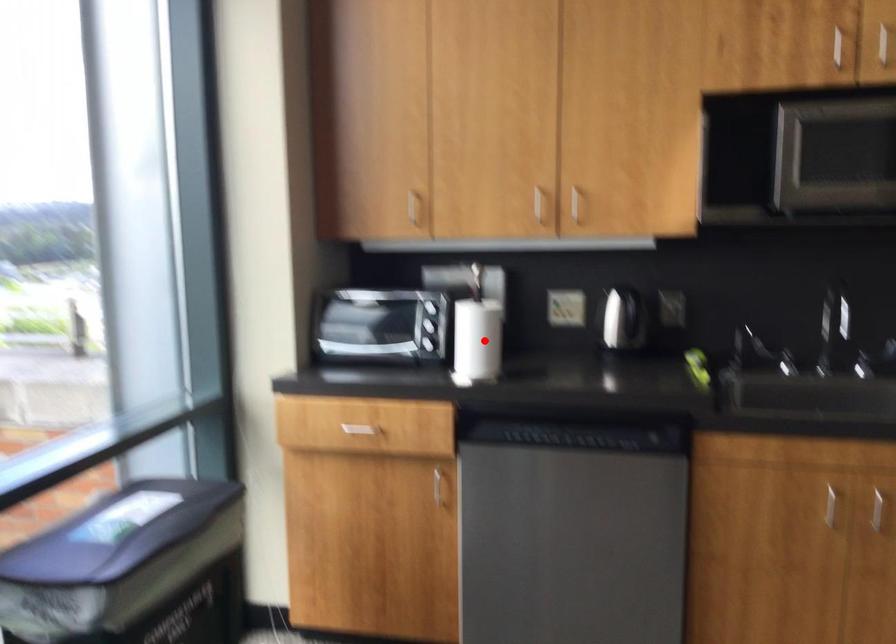
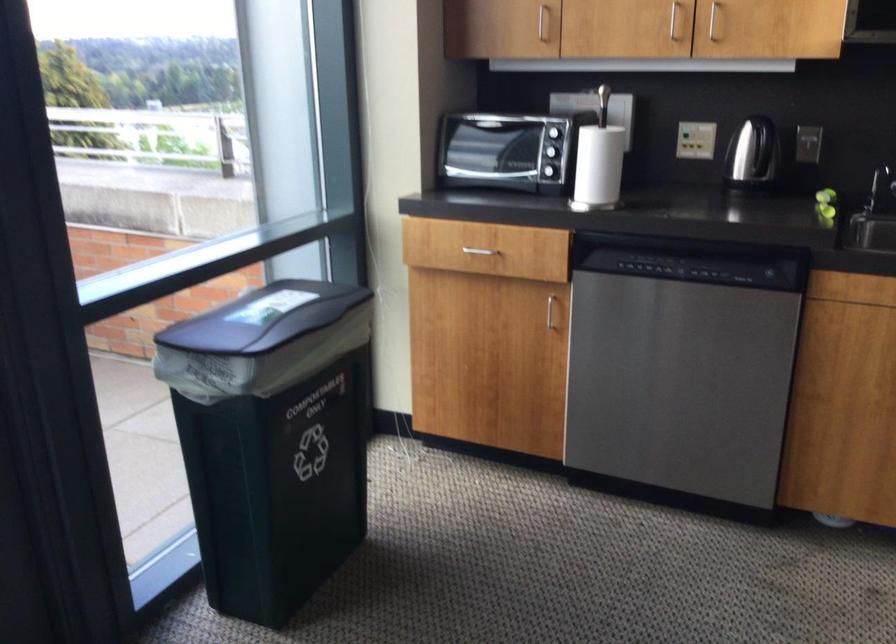
Where in the second image is the point corresponding to the highlighted location from the first image?

(599, 165)